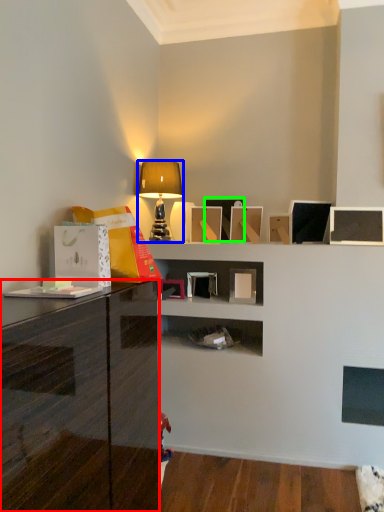
Question: Which object is positioned farthest from cabinetry (highlighted by a red box)? Select from lamp (highlighted by a blue box) and picture frame (highlighted by a green box).

Choices:
 (A) lamp
 (B) picture frame

Answer: (B)